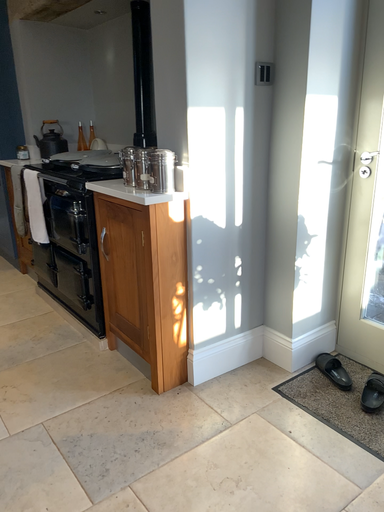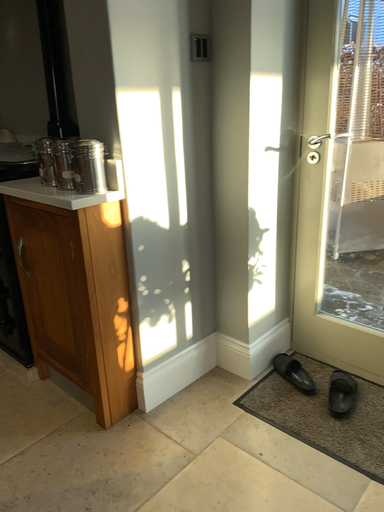
Question: Which way did the camera rotate in the video?

Choices:
 (A) rotated right
 (B) rotated left

Answer: (A)